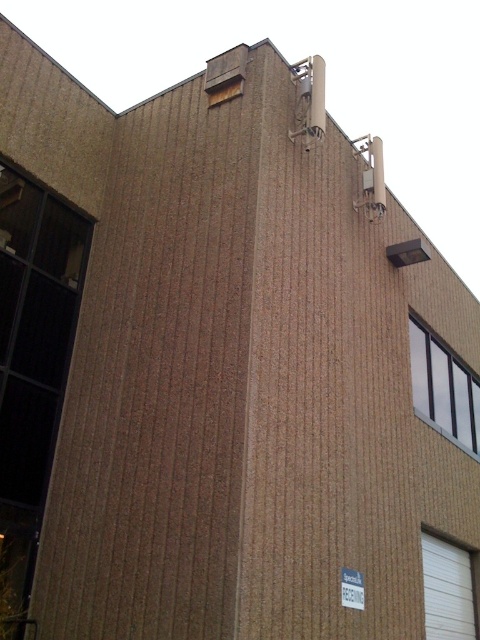
Question: Does white textured door at lower right have a greater width compared to white plastic sign at lower center?

Choices:
 (A) yes
 (B) no

Answer: (A)

Question: Does white textured door at lower right lie behind white plastic sign at lower center?

Choices:
 (A) no
 (B) yes

Answer: (B)

Question: Does white glass window at upper center have a smaller size compared to white plastic sign at lower center?

Choices:
 (A) no
 (B) yes

Answer: (A)

Question: Estimate the real-world distances between objects in this image. Which object is farther from the white glass window at upper center?

Choices:
 (A) white textured door at lower right
 (B) white plastic sign at lower center

Answer: (B)

Question: Which object appears closest to the camera in this image?

Choices:
 (A) white glass window at upper center
 (B) white textured door at lower right
 (C) white plastic sign at lower center

Answer: (C)

Question: Among these points, which one is nearest to the camera?

Choices:
 (A) (350, 593)
 (B) (463, 604)

Answer: (A)